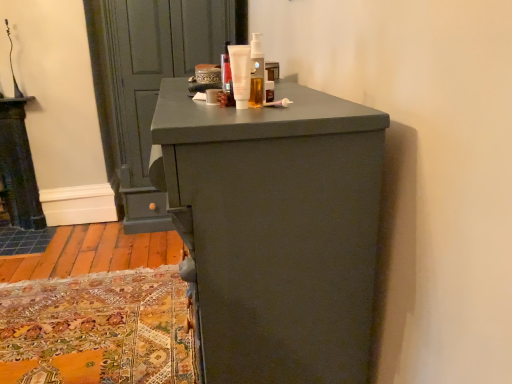
Question: Is translucent plastic bottle at upper center, which is the 1th toiletry from right to left, completely or partially inside matte white cream at center, placed as the 3th toiletry when sorted from right to left?

Choices:
 (A) no
 (B) yes

Answer: (A)

Question: Is matte white cream at center, placed as the 3th toiletry when sorted from right to left, aimed at translucent plastic bottle at upper center, which is the 1th toiletry from right to left?

Choices:
 (A) no
 (B) yes

Answer: (A)

Question: From a real-world perspective, is matte white cream at center, placed as the 3th toiletry when sorted from right to left, on top of translucent plastic bottle at upper center, which is the 3th toiletry from left to right?

Choices:
 (A) no
 (B) yes

Answer: (A)

Question: From the image's perspective, is matte white cream at center, which is counted as the first toiletry, starting from the left, on top of translucent plastic bottle at upper center, which is the 1th toiletry from right to left?

Choices:
 (A) yes
 (B) no

Answer: (B)

Question: Can you confirm if matte white cream at center, which is counted as the first toiletry, starting from the left, is wider than translucent plastic bottle at upper center, which is the 3th toiletry from left to right?

Choices:
 (A) yes
 (B) no

Answer: (A)

Question: Is matte white cream at center, which is counted as the first toiletry, starting from the left, closer to camera compared to translucent plastic bottle at upper center, which is the 3th toiletry from left to right?

Choices:
 (A) yes
 (B) no

Answer: (B)

Question: Does translucent plastic bottle at upper center, which is the 3th toiletry from left to right, have a larger size compared to matte gray door at upper left?

Choices:
 (A) yes
 (B) no

Answer: (B)

Question: From a real-world perspective, is translucent plastic bottle at upper center, which is the 1th toiletry from right to left, located higher than matte gray door at upper left?

Choices:
 (A) yes
 (B) no

Answer: (A)

Question: From the image's perspective, is translucent plastic bottle at upper center, which is the 1th toiletry from right to left, over matte gray door at upper left?

Choices:
 (A) yes
 (B) no

Answer: (B)

Question: Can we say translucent plastic bottle at upper center, which is the 1th toiletry from right to left, lies outside matte gray door at upper left?

Choices:
 (A) no
 (B) yes

Answer: (B)

Question: Can you confirm if translucent plastic bottle at upper center, which is the 1th toiletry from right to left, is taller than matte gray door at upper left?

Choices:
 (A) no
 (B) yes

Answer: (A)

Question: Can you confirm if translucent plastic bottle at upper center, which is the 1th toiletry from right to left, is wider than matte gray door at upper left?

Choices:
 (A) no
 (B) yes

Answer: (A)

Question: Does matte gray door at upper left have a smaller size compared to translucent plastic bottle at upper center, which is the 3th toiletry from left to right?

Choices:
 (A) no
 (B) yes

Answer: (A)